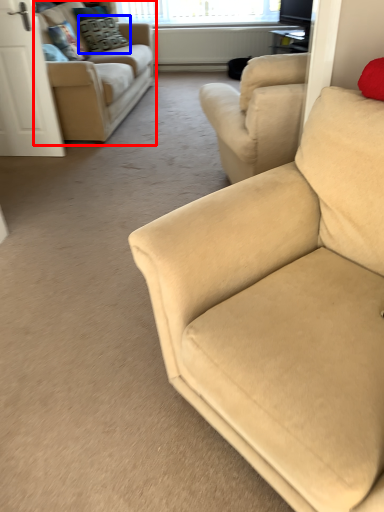
Question: Which of the following is the closest to the observer, studio couch (highlighted by a red box) or pillow (highlighted by a blue box)?

Choices:
 (A) studio couch
 (B) pillow

Answer: (A)